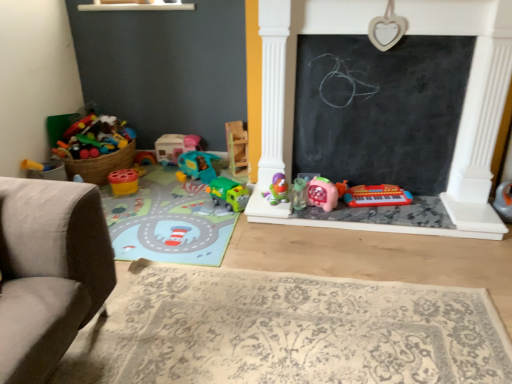
Question: Is point coord(199,165) closer or farther from the camera than point coord(360,201)?

Choices:
 (A) farther
 (B) closer

Answer: (A)

Question: Relative to red plastic keyboard at lower center, the ninth toy when ordered from left to right, is teal plastic toy car at center, the eighth toy viewed from the right, in front or behind?

Choices:
 (A) front
 (B) behind

Answer: (B)

Question: Estimate the real-world distances between objects in this image. Which object is closer to the carpeted play mat at lower left, the 1th mat from the top?

Choices:
 (A) pink plastic clock at center-right, which ranks as the 3th toy in right-to-left order
 (B) wooden block at center, positioned as the sixth toy in right-to-left order
 (C) teal plastic toy car at center, the eighth toy viewed from the right
 (D) matte plastic cup at center-left, which is the first toy in left-to-right order
 (E) clear plastic sippy cup at center, the fourth toy when ordered from right to left

Answer: (C)

Question: Considering the real-world distances, which object is closest to the carpeted play mat at lower left, which ranks as the 2th mat in bottom-to-top order?

Choices:
 (A) wooden block at center, positioned as the sixth toy in right-to-left order
 (B) clear plastic sippy cup at center, which ranks as the 7th toy in left-to-right order
 (C) green plastic truck at center, the seventh toy viewed from the right
 (D) white plastic toy at right, marked as the 10th toy in a left-to-right arrangement
 (E) matte plastic toy car at center, the 9th toy when ordered from right to left

Answer: (C)